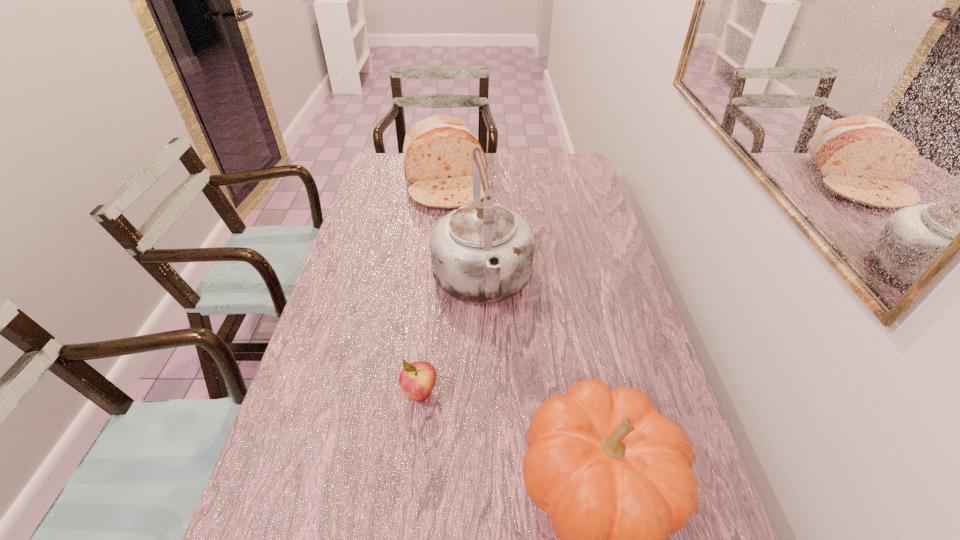
What are the coordinates of `vacant space located 0.060m at the spout of the tallest object` in the screenshot? It's located at (493, 347).

Where is `vacant area situated 0.200m at the spout of the tallest object`? vacant area situated 0.200m at the spout of the tallest object is located at coordinates (502, 393).

Where is `object situated at the far edge`? This screenshot has height=540, width=960. object situated at the far edge is located at coordinates (437, 152).

Find the location of a particular element. The image size is (960, 540). object positioned at the left edge is located at coordinates (437, 152).

Find the location of `object that is at the far left corner`. object that is at the far left corner is located at coordinates (437, 152).

Locate an element on the screen. blank area at the far edge is located at coordinates (496, 174).

At what (x,y) coordinates should I click in order to perform the action: click on free spot at the left edge of the desktop. Please return your answer as a coordinate pair (x, y). The width and height of the screenshot is (960, 540). Looking at the image, I should click on (337, 330).

In the image, there is a desktop. At what (x,y) coordinates should I click in order to perform the action: click on vacant space at the right edge. Please return your answer as a coordinate pair (x, y). The height and width of the screenshot is (540, 960). Looking at the image, I should click on (605, 281).

Locate an element on the screen. This screenshot has width=960, height=540. vacant area at the far right corner is located at coordinates (554, 170).

Where is `free area in between the second nearest object and the tallest object`? The height and width of the screenshot is (540, 960). free area in between the second nearest object and the tallest object is located at coordinates (451, 338).